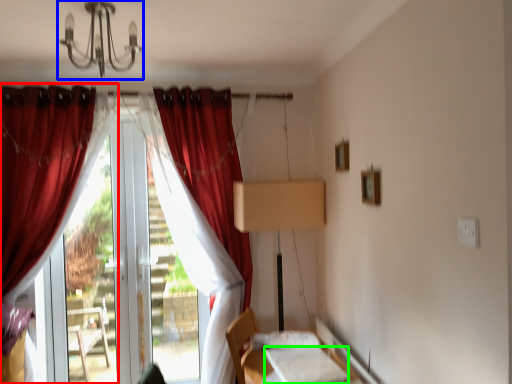
Question: Which object is the farthest from curtain (highlighted by a red box)? Choose among these: light fixture (highlighted by a blue box) or sheet (highlighted by a green box).

Choices:
 (A) light fixture
 (B) sheet

Answer: (B)